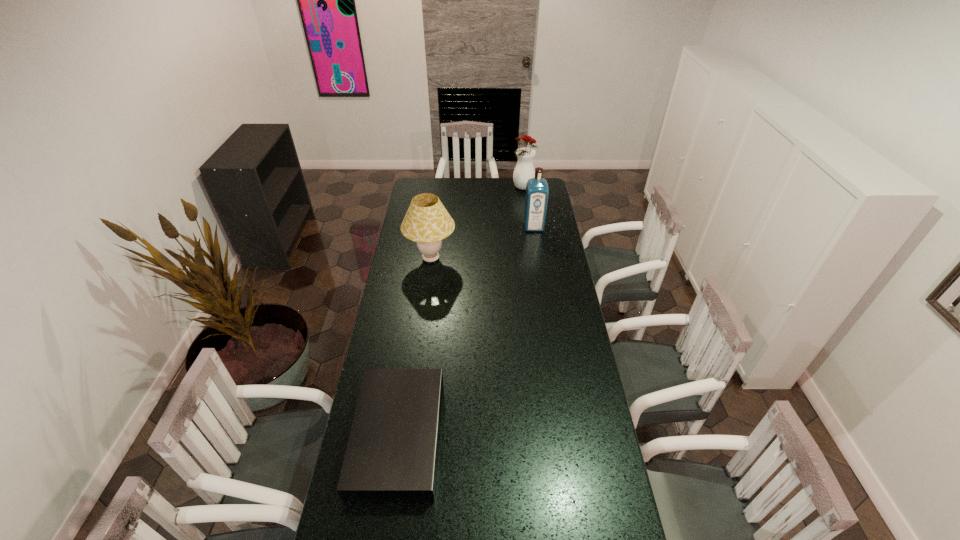
At what (x,y) coordinates should I click in order to perform the action: click on vacant point located between the second nearest object and the farthest object. Please return your answer as a coordinate pair (x, y). The height and width of the screenshot is (540, 960). Looking at the image, I should click on (477, 224).

Find the location of `free space between the second nearest object and the farthest object`. free space between the second nearest object and the farthest object is located at coordinates (477, 224).

Locate an element on the screen. unoccupied position between the farthest object and the lampshade is located at coordinates (477, 224).

Image resolution: width=960 pixels, height=540 pixels. I want to click on free space between the third farthest object and the vase, so click(477, 224).

Find the location of a particular element. The width and height of the screenshot is (960, 540). free space between the lampshade and the nearest object is located at coordinates tap(415, 348).

Where is `object that is the nearest to the third farthest object`? The width and height of the screenshot is (960, 540). object that is the nearest to the third farthest object is located at coordinates (537, 191).

Locate an element on the screen. object that is the closest to the CD player is located at coordinates (427, 222).